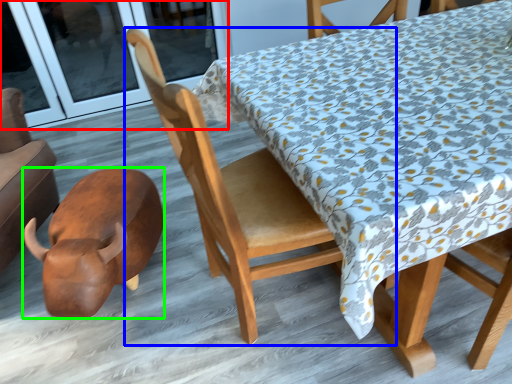
Question: Which object is positioned closest to screen door (highlighted by a red box)? Select from chair (highlighted by a blue box) and animal (highlighted by a green box).

Choices:
 (A) chair
 (B) animal

Answer: (B)